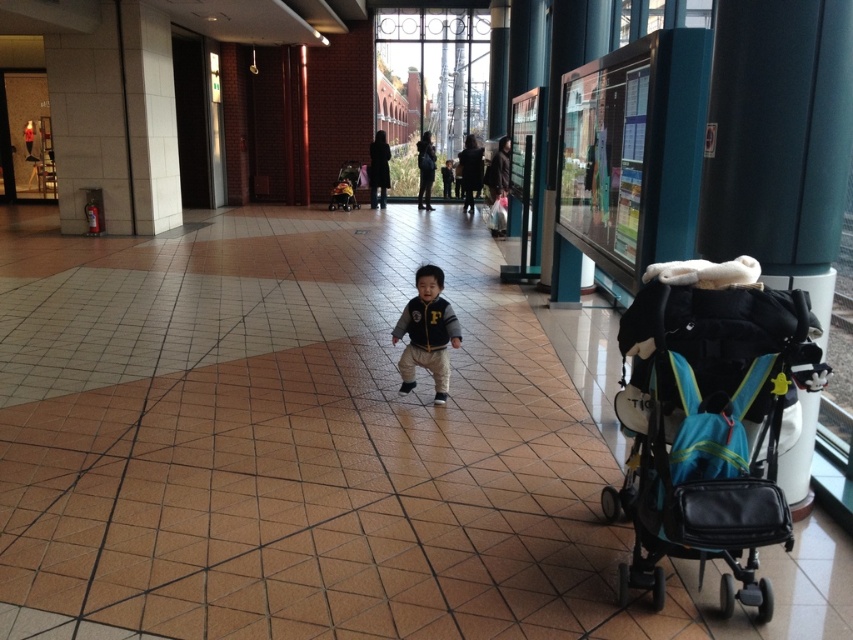
You are a parent trying to decide whether to fold the teal fabric stroller at right to store it in the trunk of your car. The trunk can only accommodate items smaller than the matte black jacket at center. Based on the scene, will the stroller fit?

The teal fabric stroller at right is larger in size than the matte black jacket at center, so it will not fit in the trunk if the trunk can only accommodate items smaller than the matte black jacket at center.

You are a parent holding a matte black jacket at center and need to place it into the teal fabric stroller at right. Can you reach the stroller without moving your position?

The teal fabric stroller at right is to the right of the matte black jacket at center, so you can reach it by extending your arm to the right side.